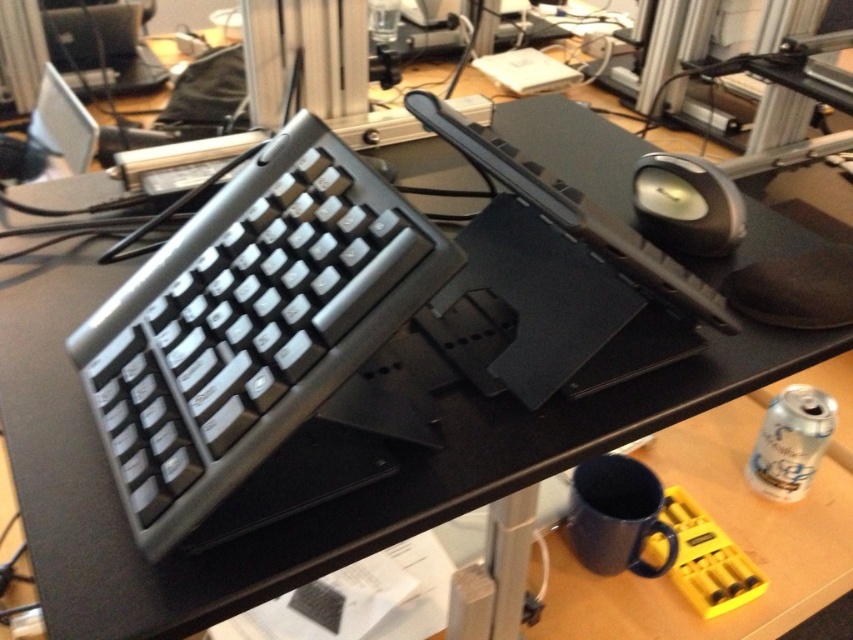
You are setting up a new desk and have a silver metallic keyboard at left and a black rubber mouse at upper right. Which object is positioned closer to you?

The silver metallic keyboard at left is closer to the viewer than the black rubber mouse at upper right.

You are a photographer setting up a shot of the workspace. You need to focus on two points on the desk marked as point (314, 115) and point (665, 243). Which point should you focus on first if you want to start with the one closer to the camera?

Point (314, 115) is closer to the camera than point (665, 243), so you should focus on point (314, 115) first.